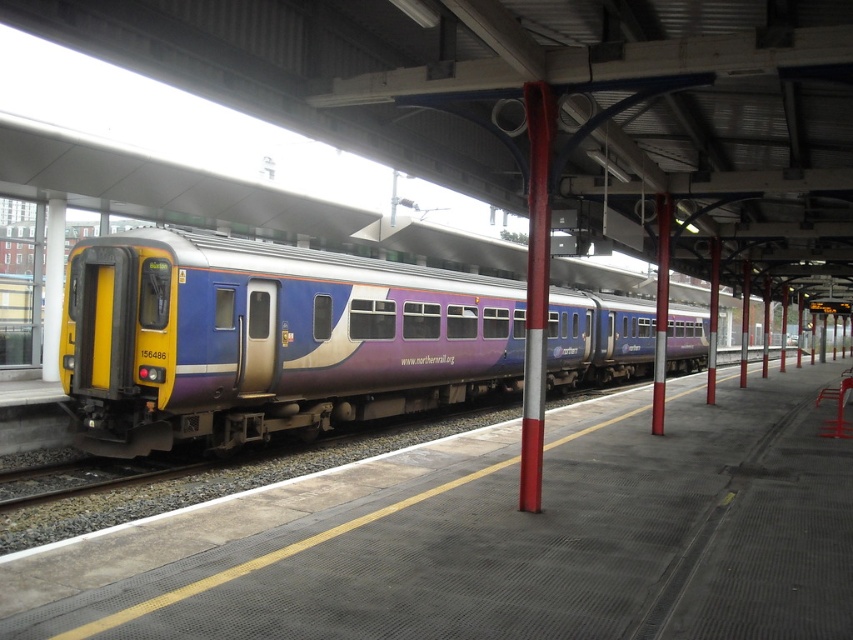
You are standing on the train station platform and see the metallic red pole at center and the metallic pole at center. Which pole is positioned to the left?

The metallic red pole at center is positioned to the left of the metallic pole at center.